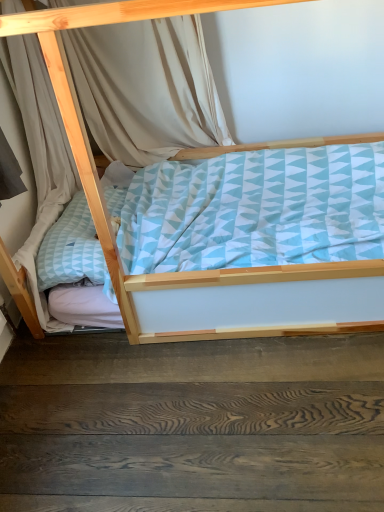
What is the approximate height of light blue fabric bed at center?

1.16 meters.

Describe the element at coordinates (146, 88) in the screenshot. I see `beige fabric curtain at upper left` at that location.

You are a GUI agent. You are given a task and a screenshot of the screen. Output one action in this format:
    pyautogui.click(x=<x>, y=<y>)
    Task: Click on the light blue fabric bed at center
    The width and height of the screenshot is (384, 512).
    Given the screenshot: What is the action you would take?
    pyautogui.click(x=102, y=193)

Is dark wood floor at lower center surrounded by beige fabric curtain at upper left?

No, dark wood floor at lower center is not surrounded by beige fabric curtain at upper left.

Considering the relative sizes of beige fabric curtain at upper left and dark wood floor at lower center in the image provided, is beige fabric curtain at upper left wider than dark wood floor at lower center?

No, beige fabric curtain at upper left is not wider than dark wood floor at lower center.

Would you consider beige fabric curtain at upper left to be distant from dark wood floor at lower center?

Indeed, beige fabric curtain at upper left is not near dark wood floor at lower center.

Is beige fabric curtain at upper left taller than dark wood floor at lower center?

Yes.

Considering the relative positions of dark wood floor at lower center and beige fabric curtain at upper left in the image provided, is dark wood floor at lower center to the left of beige fabric curtain at upper left from the viewer's perspective?

No, dark wood floor at lower center is not to the left of beige fabric curtain at upper left.

Which object is closer to the camera, dark wood floor at lower center or beige fabric curtain at upper left?

dark wood floor at lower center is in front.

What's the angular difference between dark wood floor at lower center and beige fabric curtain at upper left's facing directions?

dark wood floor at lower center and beige fabric curtain at upper left are facing 179 degrees away from each other.

Is there a large distance between dark wood floor at lower center and beige fabric curtain at upper left?

Yes, dark wood floor at lower center and beige fabric curtain at upper left are quite far apart.

How different are the orientations of dark wood floor at lower center and light blue fabric bed at center in degrees?

The angle between the facing direction of dark wood floor at lower center and the facing direction of light blue fabric bed at center is 178 degrees.

In terms of height, does dark wood floor at lower center look taller or shorter compared to light blue fabric bed at center?

Considering their sizes, dark wood floor at lower center has less height than light blue fabric bed at center.

Is dark wood floor at lower center oriented away from light blue fabric bed at center?

dark wood floor at lower center is not turned away from light blue fabric bed at center.

Considering the positions of points (130, 35) and (127, 306), is point (130, 35) farther from camera compared to point (127, 306)?

Yes, it is behind point (127, 306).

Find the location of a particular element. This screenshot has height=512, width=384. curtain behind the light blue fabric bed at center is located at coordinates (146, 88).

Is beige fabric curtain at upper left located outside light blue fabric bed at center?

No, most part of beige fabric curtain at upper left lies within light blue fabric bed at center.

Could you tell me if beige fabric curtain at upper left is turned towards light blue fabric bed at center?

Yes, beige fabric curtain at upper left is turned towards light blue fabric bed at center.

Considering the points (224, 3) and (158, 130), which point is in front, point (224, 3) or point (158, 130)?

The point (224, 3) is in front.

Which of these two, light blue fabric bed at center or beige fabric curtain at upper left, is bigger?

With larger size is light blue fabric bed at center.

Is light blue fabric bed at center not within beige fabric curtain at upper left?

Indeed, light blue fabric bed at center is completely outside beige fabric curtain at upper left.

Based on their sizes in the image, would you say light blue fabric bed at center is bigger or smaller than dark wood floor at lower center?

In the image, light blue fabric bed at center appears to be larger than dark wood floor at lower center.

Between light blue fabric bed at center and dark wood floor at lower center, which one appears on the left side from the viewer's perspective?

dark wood floor at lower center is more to the left.

At what (x,y) coordinates should I click in order to perform the action: click on bed located above the dark wood floor at lower center (from the image's perspective). Please return your answer as a coordinate pair (x, y). The width and height of the screenshot is (384, 512). Looking at the image, I should click on (102, 193).

Locate an element on the screen. The width and height of the screenshot is (384, 512). curtain lying on the left of dark wood floor at lower center is located at coordinates (146, 88).

Image resolution: width=384 pixels, height=512 pixels. In order to click on curtain located behind the dark wood floor at lower center in this screenshot , I will do `click(146, 88)`.

From the image, which object appears to be nearer to beige fabric curtain at upper left, dark wood floor at lower center or light blue fabric bed at center?

light blue fabric bed at center.

Based on their spatial positions, is beige fabric curtain at upper left or light blue fabric bed at center closer to dark wood floor at lower center?

Among the two, light blue fabric bed at center is located nearer to dark wood floor at lower center.

Which object lies nearer to the anchor point beige fabric curtain at upper left, light blue fabric bed at center or dark wood floor at lower center?

The object closer to beige fabric curtain at upper left is light blue fabric bed at center.

Which object lies further to the anchor point light blue fabric bed at center, beige fabric curtain at upper left or dark wood floor at lower center?

Based on the image, beige fabric curtain at upper left appears to be further to light blue fabric bed at center.

Which object lies nearer to the anchor point light blue fabric bed at center, dark wood floor at lower center or beige fabric curtain at upper left?

The object closer to light blue fabric bed at center is dark wood floor at lower center.

From the image, which object appears to be farther from dark wood floor at lower center, light blue fabric bed at center or beige fabric curtain at upper left?

beige fabric curtain at upper left lies further to dark wood floor at lower center than the other object.

Identify the location of bed between beige fabric curtain at upper left and dark wood floor at lower center in the up-down direction. The height and width of the screenshot is (512, 384). tap(102, 193).